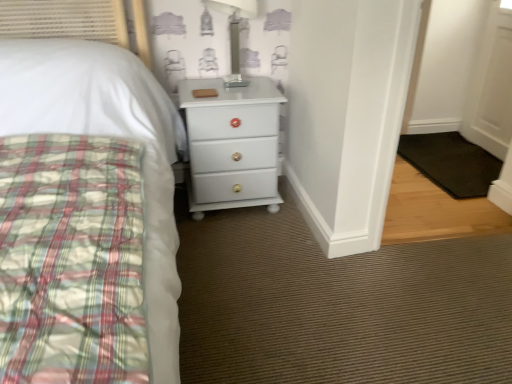
This screenshot has height=384, width=512. What do you see at coordinates (234, 34) in the screenshot? I see `transparent glass table lamp at upper center` at bounding box center [234, 34].

At what (x,y) coordinates should I click in order to perform the action: click on white glossy chest of drawers at center. Please return your answer as a coordinate pair (x, y). The width and height of the screenshot is (512, 384). Looking at the image, I should click on (232, 144).

This screenshot has width=512, height=384. In order to click on the chest of drawers located above the black rubber mat at lower right (from a real-world perspective) in this screenshot , I will do `click(232, 144)`.

Would you say white glossy chest of drawers at center is inside or outside black rubber mat at lower right?

white glossy chest of drawers at center is located beyond the bounds of black rubber mat at lower right.

Can you confirm if white glossy chest of drawers at center is thinner than black rubber mat at lower right?

Indeed, white glossy chest of drawers at center has a lesser width compared to black rubber mat at lower right.

Visually, is black rubber mat at lower right positioned to the left or to the right of transparent glass table lamp at upper center?

Based on their positions, black rubber mat at lower right is located to the right of transparent glass table lamp at upper center.

I want to click on table lamp on the left of black rubber mat at lower right, so click(x=234, y=34).

Does black rubber mat at lower right have a greater width compared to transparent glass table lamp at upper center?

Yes.

Is transparent glass table lamp at upper center oriented away from white glossy chest of drawers at center?

No.

Does transparent glass table lamp at upper center have a lesser height compared to white glossy chest of drawers at center?

Correct, transparent glass table lamp at upper center is not as tall as white glossy chest of drawers at center.

Do you think transparent glass table lamp at upper center is within white glossy chest of drawers at center, or outside of it?

transparent glass table lamp at upper center lies outside white glossy chest of drawers at center.

Between transparent glass table lamp at upper center and white glossy chest of drawers at center, which one has larger width?

Wider between the two is white glossy chest of drawers at center.

Would you say transparent glass table lamp at upper center contains black rubber mat at lower right?

No, black rubber mat at lower right is not inside transparent glass table lamp at upper center.

Who is bigger, transparent glass table lamp at upper center or black rubber mat at lower right?

black rubber mat at lower right is bigger.

Which is nearer, (232, 39) or (479, 169)?

The point (232, 39) is more forward.

Is transparent glass table lamp at upper center turned away from black rubber mat at lower right?

transparent glass table lamp at upper center is not turned away from black rubber mat at lower right.

Looking at this image, which is further, (252, 96) or (240, 3)?

The point (240, 3) is behind.

Is white glossy chest of drawers at center beside transparent glass table lamp at upper center?

No, white glossy chest of drawers at center is not making contact with transparent glass table lamp at upper center.

From the image's perspective, is white glossy chest of drawers at center below transparent glass table lamp at upper center?

Indeed, from the image's perspective, white glossy chest of drawers at center is shown beneath transparent glass table lamp at upper center.

Can transparent glass table lamp at upper center be found inside white glossy chest of drawers at center?

No, transparent glass table lamp at upper center is not inside white glossy chest of drawers at center.

From the image's perspective, is black rubber mat at lower right located above or below white glossy chest of drawers at center?

Based on their image positions, black rubber mat at lower right is located beneath white glossy chest of drawers at center.

Between black rubber mat at lower right and white glossy chest of drawers at center, which one has less height?

Result: With less height is black rubber mat at lower right.

Which is behind, point (421, 168) or point (186, 89)?

The point (421, 168) is farther.

At what (x,y) coordinates should I click in order to perform the action: click on mat on the right of white glossy chest of drawers at center. Please return your answer as a coordinate pair (x, y). Looking at the image, I should click on (451, 163).

At what (x,y) coordinates should I click in order to perform the action: click on table lamp on the left of black rubber mat at lower right. Please return your answer as a coordinate pair (x, y). Looking at the image, I should click on (234, 34).

Based on their spatial positions, is transparent glass table lamp at upper center or white glossy chest of drawers at center further from black rubber mat at lower right?

transparent glass table lamp at upper center.

Looking at the image, which one is located further to transparent glass table lamp at upper center, black rubber mat at lower right or white glossy chest of drawers at center?

black rubber mat at lower right lies further to transparent glass table lamp at upper center than the other object.

From the image, which object appears to be farther from black rubber mat at lower right, white glossy chest of drawers at center or transparent glass table lamp at upper center?

The object further to black rubber mat at lower right is transparent glass table lamp at upper center.

Looking at the image, which one is located closer to white glossy chest of drawers at center, transparent glass table lamp at upper center or black rubber mat at lower right?

transparent glass table lamp at upper center is positioned closer to the anchor white glossy chest of drawers at center.

Considering their positions, is black rubber mat at lower right positioned further to white glossy chest of drawers at center than transparent glass table lamp at upper center?

Based on the image, black rubber mat at lower right appears to be further to white glossy chest of drawers at center.

Which object lies nearer to the anchor point transparent glass table lamp at upper center, white glossy chest of drawers at center or black rubber mat at lower right?

Among the two, white glossy chest of drawers at center is located nearer to transparent glass table lamp at upper center.

Identify the location of table lamp situated between white glossy chest of drawers at center and black rubber mat at lower right from left to right. (234, 34).